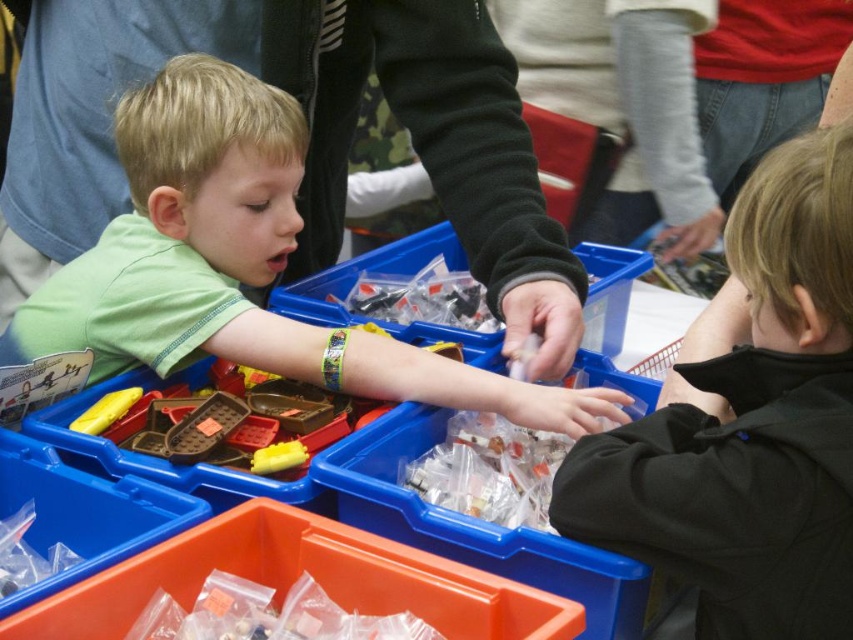
Between point (80, 326) and point (436, 456), which one is positioned behind?

Point (80, 326)

Is green matte shirt at center above translucent plastic bag at center?

Yes, green matte shirt at center is above translucent plastic bag at center.

Is point (74, 339) farther from viewer compared to point (469, 502)?

That is True.

What are the coordinates of `green matte shirt at center` in the screenshot? It's located at (238, 262).

Which is behind, point (685, 429) or point (252, 200)?

The point (252, 200) is behind.

Can you confirm if black matte jacket at right is positioned to the left of green matte shirt at center?

Incorrect, black matte jacket at right is not on the left side of green matte shirt at center.

I want to click on black matte jacket at right, so click(749, 424).

Can you confirm if black matte jacket at right is wider than translucent plastic bag at center?

Yes, black matte jacket at right is wider than translucent plastic bag at center.

Looking at this image, does black matte jacket at right have a lesser height compared to translucent plastic bag at center?

In fact, black matte jacket at right may be taller than translucent plastic bag at center.

Where is `black matte jacket at right`? The height and width of the screenshot is (640, 853). black matte jacket at right is located at coordinates (749, 424).